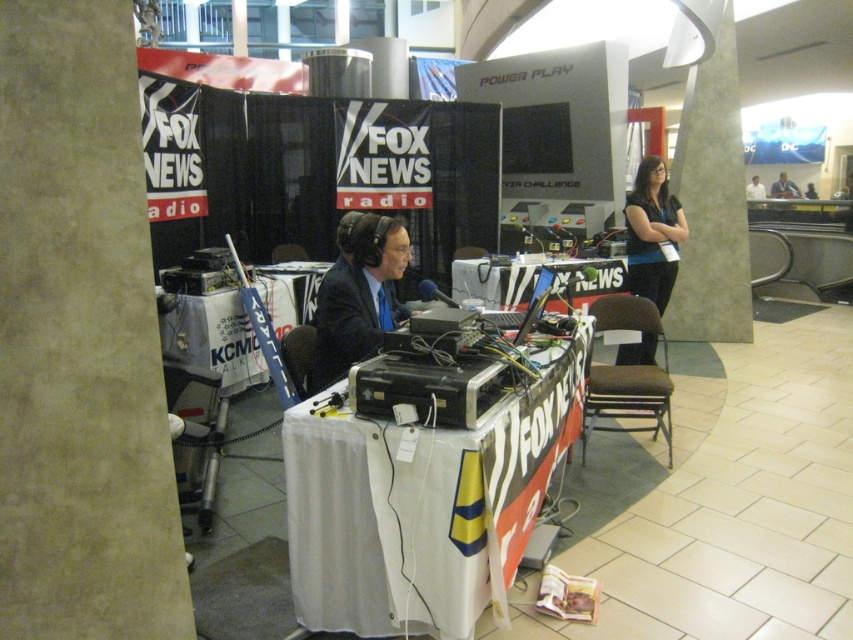
You are a guest speaker at the Fox News Radio event. You need to sit down to speak. The host tells you to sit on the matte black suit at center. Where should you sit relative to the white fabric table at center?

The matte black suit at center is to the left of the white fabric table at center, so you should sit to the left of the white fabric table at center.

From the picture: You are a guest speaker at the Fox News Radio broadcast station. You need to choose a shirt to wear that will not overwhelm the logos on the table. Which shirt, the blue denim shirt at right or the black glossy shirt at upper center, is narrower and thus less likely to distract from the logos?

The blue denim shirt at right has a lesser width compared to the black glossy shirt at upper center, so it is narrower and less likely to distract from the logos.

You are a technician who needs to move a 24 inch wide equipment box from the white fabric table at center to the matte black suit at center. Can you slide it directly without rotating it?

The distance between the white fabric table at center and the matte black suit at center is 25.47 inches, so yes, you can slide the 24 inch wide equipment box directly without rotating it since it is narrower than the available space.